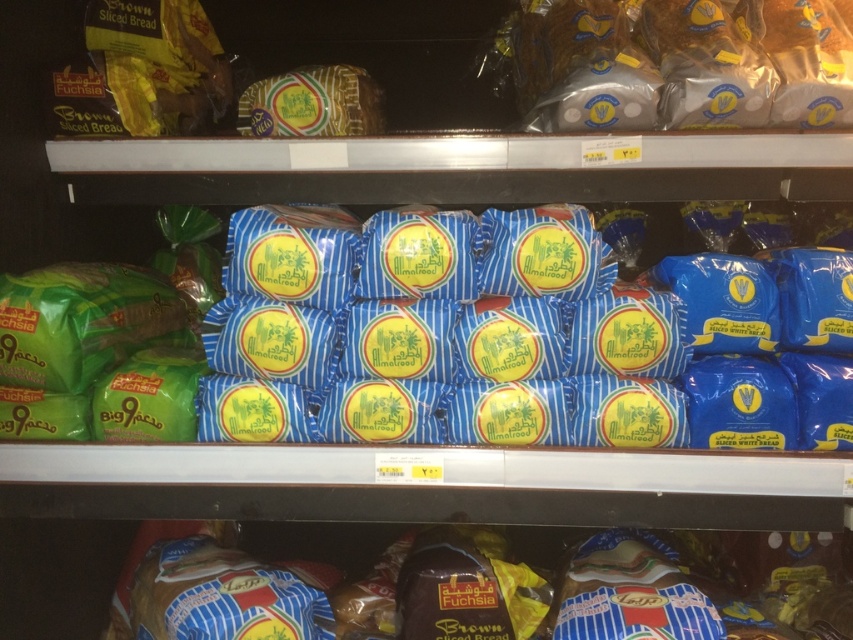
Question: Can you confirm if golden brown bread at upper right is bigger than brown textured bread at lower center?

Choices:
 (A) no
 (B) yes

Answer: (B)

Question: Which object appears closest to the camera in this image?

Choices:
 (A) brown textured bread at lower center
 (B) golden brown bread at upper right

Answer: (B)

Question: In this image, where is golden brown bread at upper right located relative to brown textured bread at lower center?

Choices:
 (A) below
 (B) above

Answer: (B)

Question: Can you confirm if golden brown bread at upper right is positioned to the right of brown textured bread at lower center?

Choices:
 (A) yes
 (B) no

Answer: (B)

Question: Which of the following is the farthest from the observer?

Choices:
 (A) golden brown bread at upper right
 (B) brown textured bread at lower center

Answer: (B)